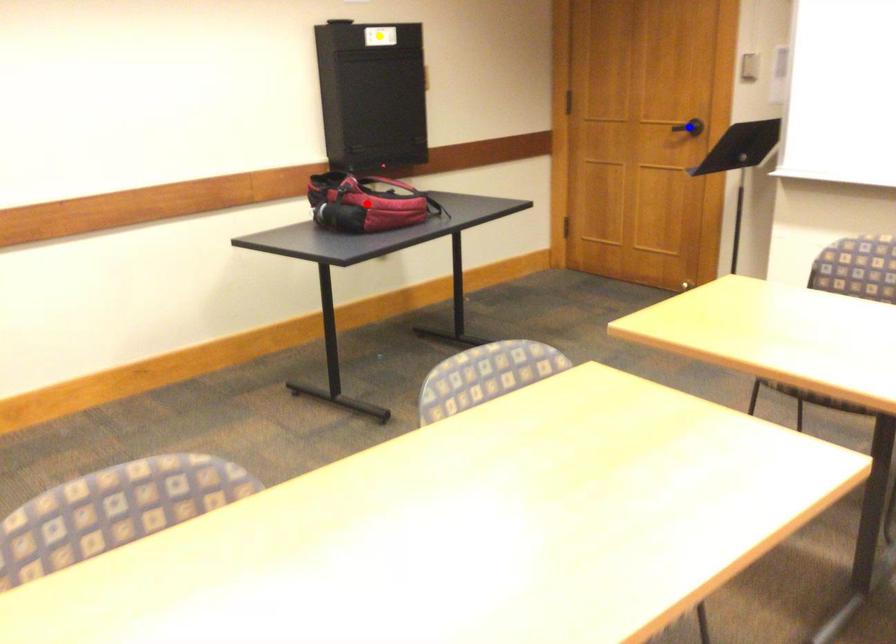
Order these from nearest to farthest:
blue point, red point, yellow point

Result: blue point → yellow point → red point